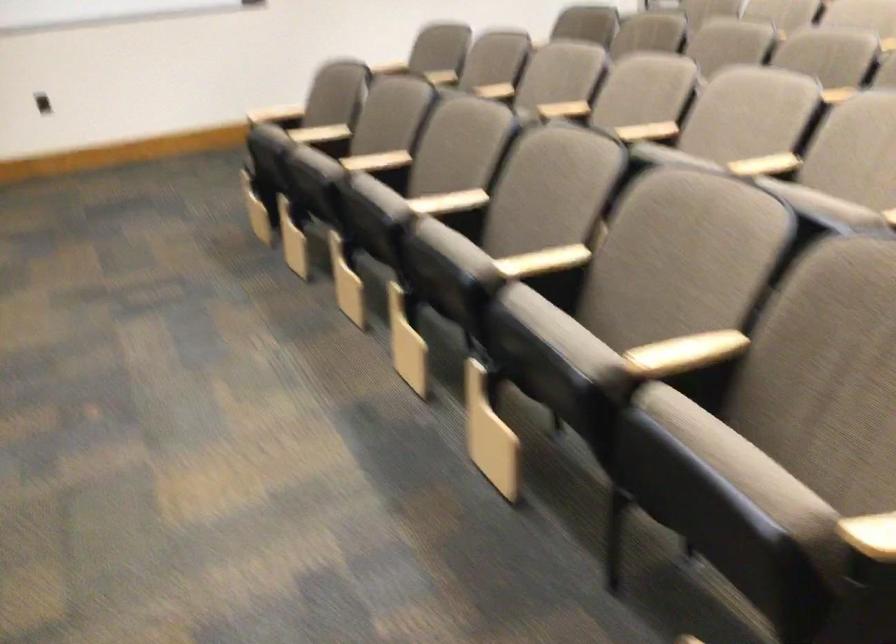
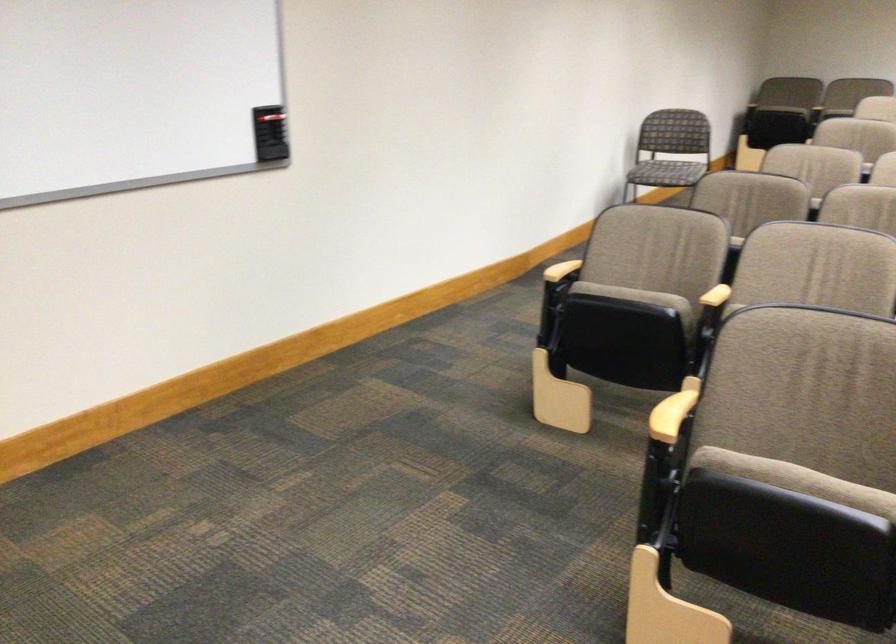
The point at (252, 124) is marked in the first image. Where is the corresponding point in the second image?

(796, 480)